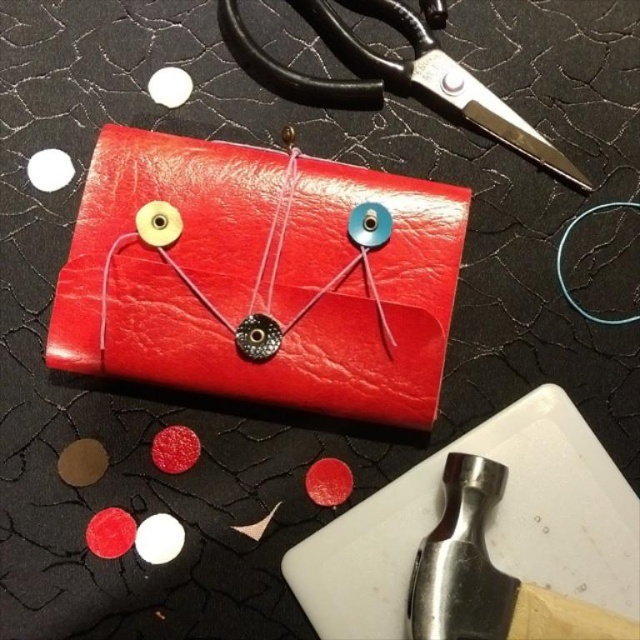
You are a craftsman working on the crafting setup. You need to place the polished metal hammer at bottom right exactly at point 0.898, 0.761. Where should you place it?

The polished metal hammer at bottom right should be placed at point (486,573).

You are observing the crafting setup and want to place a new button between the two points, point (433, 360) and point (422, 582). Which point is closer to the camera where you should start placing the button first?

Point (433, 360) is further to the camera than point (422, 582), so you should start placing the button closer to point (422, 582) first since it is nearer to the camera.

You are an artisan working on a project and need to choose between the polished metal hammer at bottom right and the black metal scissors at upper center. Which tool is wider?

The black metal scissors at upper center is wider than the polished metal hammer at bottom right.